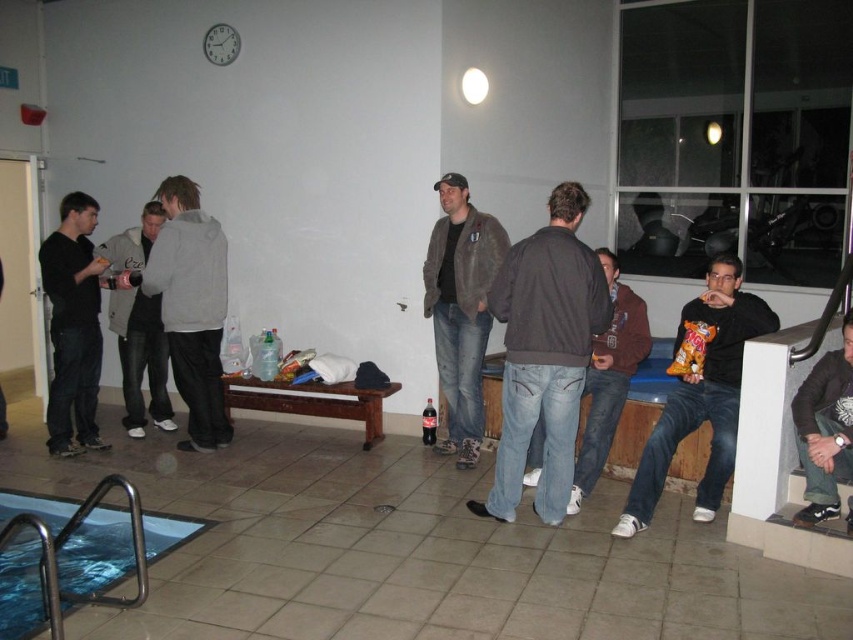
You are at a social gathering near a pool. You see a metallic blue water at bottom left and a dark gray hoodie at center. Which object is positioned more to the right?

The metallic blue water at bottom left is to the right of the dark gray hoodie at center.

You are a person who is 1.6 meters tall and wants to reach the metallic blue water at bottom left from where you are standing near the dark gray hoodie at center. Can you safely step into the water without needing to jump?

The metallic blue water at bottom left is 1.72 meters away from the dark gray hoodie at center. Since you are 1.6 meters tall, the distance between you and the water is greater than your height, so you would need to jump or move closer to reach it safely.

You are at a social gathering by a pool. You have to move from the metallic blue water at bottom left to the brown suede jacket at center. Is the path between them wide enough for you to walk through comfortably?

The metallic blue water at bottom left might be wider than brown suede jacket at center, so the path between them could be wide enough for comfortable passage.